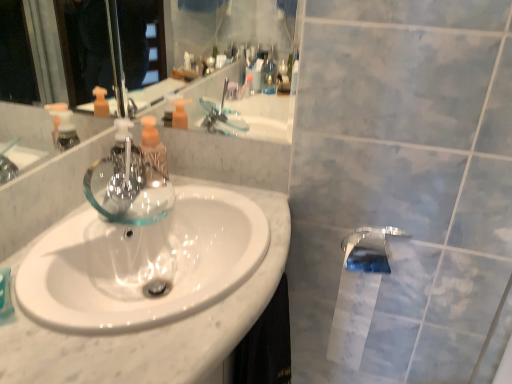
Identify the location of vacant area located to the right-hand side of translucent plastic soap dispenser at center. (x=208, y=198).